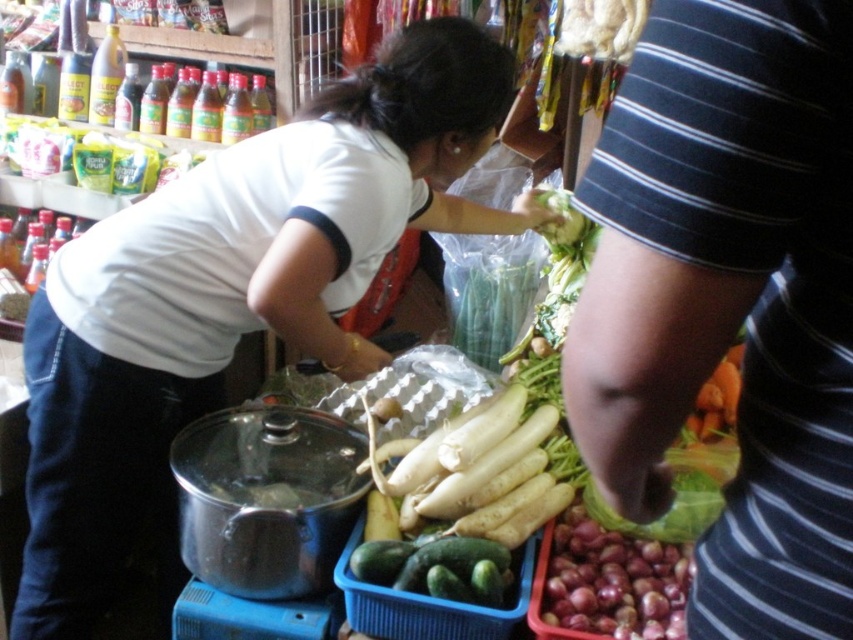
You are a vendor at the market and need to place a 24 inch long wooden board between the striped fabric arm at right and the green matte cucumber at center. Can the board fit without overlapping either object?

The distance between the striped fabric arm at right and the green matte cucumber at center is 25.70 inches. Since the board is 24 inches long, it can fit within the space as 24 is less than 25.70.